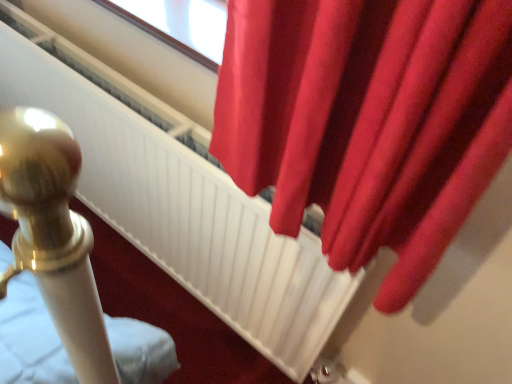
Identify the location of white ribbed radiator at upper center. The image size is (512, 384). (180, 202).

The width and height of the screenshot is (512, 384). What do you see at coordinates (180, 202) in the screenshot? I see `white ribbed radiator at upper center` at bounding box center [180, 202].

Locate an element on the screen. The width and height of the screenshot is (512, 384). white ribbed radiator at upper center is located at coordinates (180, 202).